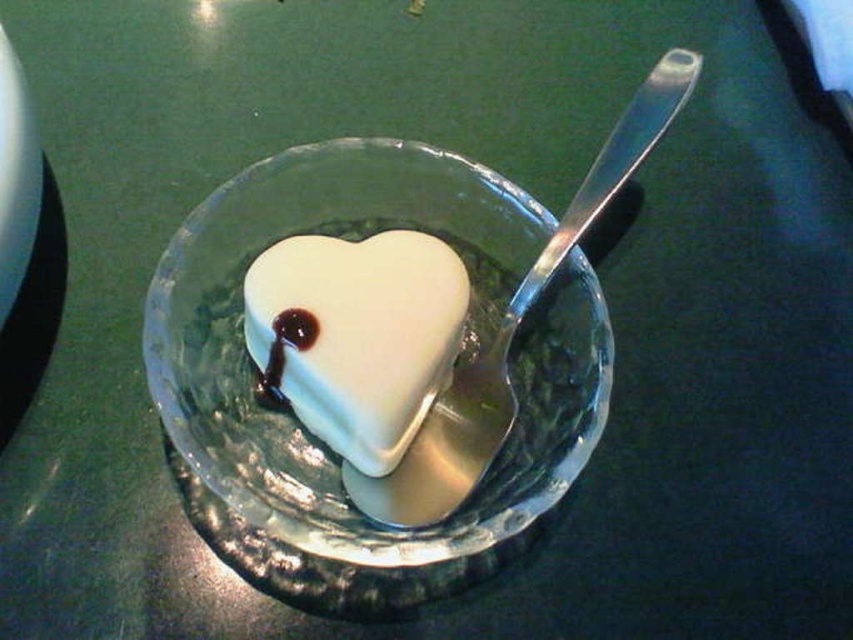
Is transparent glass bowl at center to the left of satin silver spoon at upper right from the viewer's perspective?

Indeed, transparent glass bowl at center is positioned on the left side of satin silver spoon at upper right.

Who is more distant from viewer, [514,212] or [405,454]?

Point [514,212]

Between point (529, 200) and point (630, 104), which one is positioned in front?

Point (529, 200)

You are a GUI agent. You are given a task and a screenshot of the screen. Output one action in this format:
    pyautogui.click(x=<x>, y=<y>)
    Task: Click on the transparent glass bowl at center
    
    Given the screenshot: What is the action you would take?
    pyautogui.click(x=316, y=440)

Is point (178, 330) less distant than point (456, 284)?

That is True.

Is transparent glass bowl at center positioned at the back of white glossy heart at center?

No.

Is point (419, 541) positioned behind point (309, 243)?

No, it is not.

Where is `transparent glass bowl at center`? Image resolution: width=853 pixels, height=640 pixels. transparent glass bowl at center is located at coordinates (316, 440).

In the scene shown: Who is higher up, white glossy heart at center or satin silver spoon at upper right?

satin silver spoon at upper right is above.

Can you confirm if white glossy heart at center is positioned to the left of satin silver spoon at upper right?

Yes, white glossy heart at center is to the left of satin silver spoon at upper right.

Who is more distant from viewer, (380, 314) or (590, 164)?

The point (590, 164) is more distant.

Locate an element on the screen. This screenshot has width=853, height=640. white glossy heart at center is located at coordinates (358, 333).